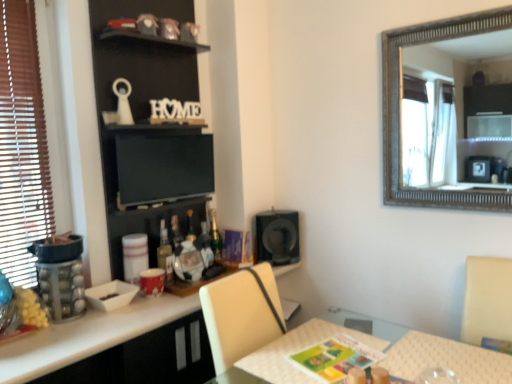
Question: Looking at their shapes, would you say green glass bottle at center, the 2th bottle viewed from the front, is wider or thinner than black matte bookshelf at upper left?

Choices:
 (A) thin
 (B) wide

Answer: (A)

Question: From the image's perspective, is green glass bottle at center, the 1th bottle positioned from the back, positioned above or below black matte bookshelf at upper left?

Choices:
 (A) above
 (B) below

Answer: (B)

Question: Which object is the farthest from the black matte speaker at center?

Choices:
 (A) matte glass bottle at center, the first bottle in the left-to-right sequence
 (B) green glass bottle at center, the 1th bottle positioned from the back
 (C) black matte bookshelf at upper left
 (D) clear plastic container at left
 (E) black glossy cabinet at lower center

Answer: (D)

Question: Which object is the closest to the green glass bottle at center, the 1th bottle positioned from the back?

Choices:
 (A) black matte bookshelf at upper left
 (B) matte glass bottle at center, the second bottle viewed from the back
 (C) black matte speaker at center
 (D) black glossy cabinet at lower center
 (E) clear plastic container at left

Answer: (B)